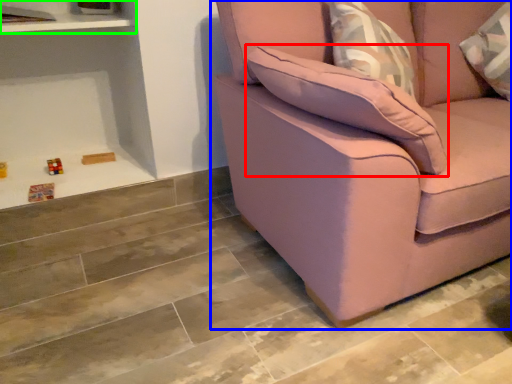
Question: Estimate the real-world distances between objects in this image. Which object is closer to pillow (highlighted by a red box), studio couch (highlighted by a blue box) or shelf (highlighted by a green box)?

Choices:
 (A) studio couch
 (B) shelf

Answer: (A)